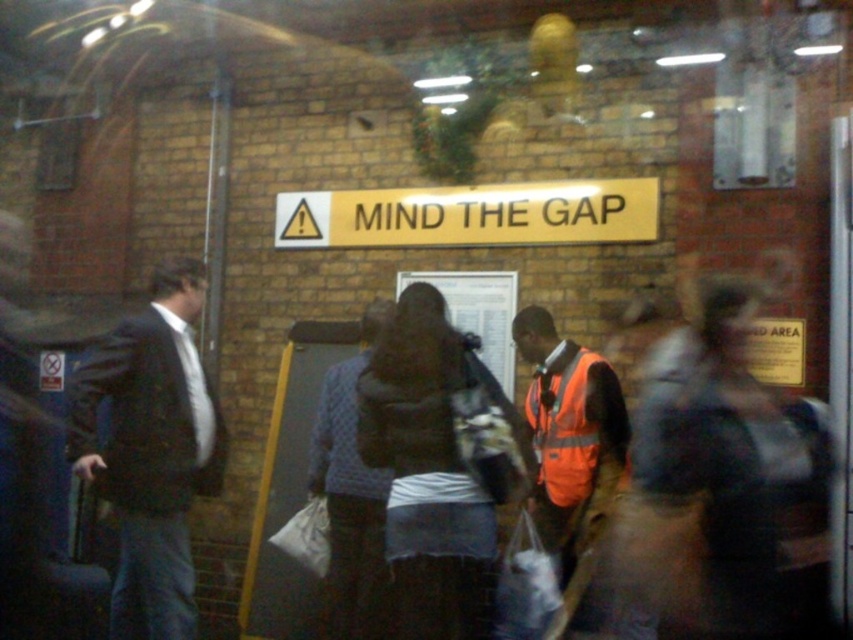
You are standing at the subway platform and want to know which of the two points, point (213, 480) or point (630, 184), is closer to you. Based on the coordinates provided, can you determine which point is nearer?

Point (213, 480) is closer to the viewer than point (630, 184).

You are a commuter waiting for the train and see the orange reflective vest at left and the gold metallic sign at center. Which object is closer to the left edge of the platform?

The orange reflective vest at left is closer to the left edge of the platform since it is positioned on the left side of the gold metallic sign at center.

From the picture: You are a passenger on the platform and need to locate the orange reflective vest at left. Based on its coordinates, where should you look relative to the MIND THE GAP sign?

The orange reflective vest at left is positioned at coordinates point (151, 451), which places it to the right and slightly below the MIND THE GAP sign on the platform.